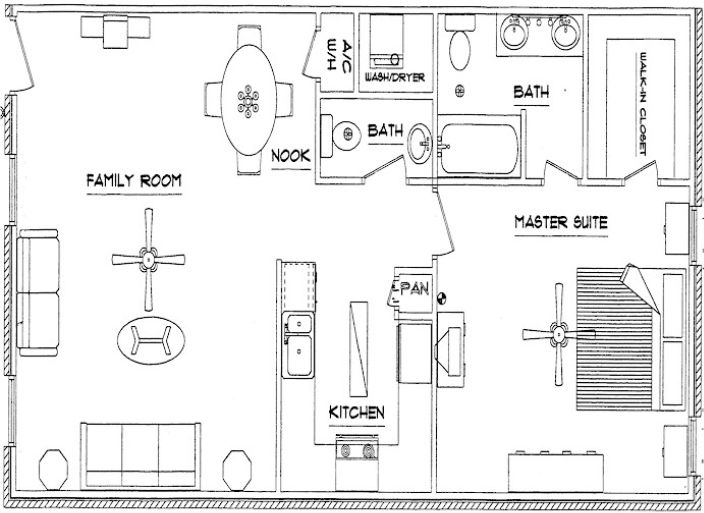
This screenshot has height=513, width=704. I want to click on room you sleep in, so click(x=603, y=315).